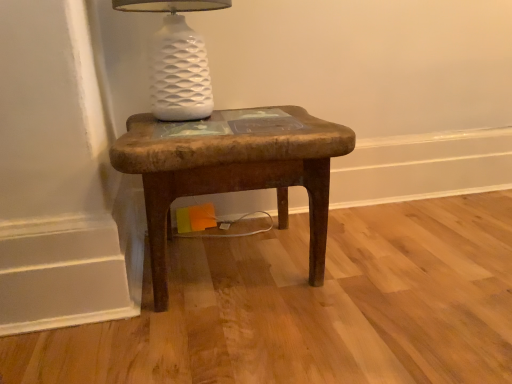
In order to face white ceramic lamp at upper center, should I rotate leftwards or rightwards?

Rotate left and turn 10.323 degrees.

This screenshot has width=512, height=384. Identify the location of white ceramic lamp at upper center. (177, 60).

What do you see at coordinates (177, 60) in the screenshot? I see `white ceramic lamp at upper center` at bounding box center [177, 60].

What do you see at coordinates (231, 169) in the screenshot? I see `rustic wood stool at center` at bounding box center [231, 169].

This screenshot has height=384, width=512. Find the location of `rustic wood stool at center`. rustic wood stool at center is located at coordinates (231, 169).

In order to click on white ceramic lamp at upper center in this screenshot , I will do `click(177, 60)`.

Is rustic wood stool at center to the right of white ceramic lamp at upper center from the viewer's perspective?

Indeed, rustic wood stool at center is positioned on the right side of white ceramic lamp at upper center.

Which object is closer to the camera, rustic wood stool at center or white ceramic lamp at upper center?

rustic wood stool at center is more forward.

Is point (225, 177) behind point (158, 48)?

No.

From the image's perspective, is rustic wood stool at center positioned above or below white ceramic lamp at upper center?

Based on their image positions, rustic wood stool at center is located beneath white ceramic lamp at upper center.

From a real-world perspective, is rustic wood stool at center positioned under white ceramic lamp at upper center based on gravity?

Yes, from a real-world perspective, rustic wood stool at center is beneath white ceramic lamp at upper center.

In the scene shown: Between rustic wood stool at center and white ceramic lamp at upper center, which one has larger width?

rustic wood stool at center.

Which of these two, rustic wood stool at center or white ceramic lamp at upper center, stands shorter?

Standing shorter between the two is white ceramic lamp at upper center.

Based on their sizes in the image, would you say rustic wood stool at center is bigger or smaller than white ceramic lamp at upper center?

In the image, rustic wood stool at center appears to be larger than white ceramic lamp at upper center.

Is rustic wood stool at center spatially inside white ceramic lamp at upper center, or outside of it?

rustic wood stool at center cannot be found inside white ceramic lamp at upper center.

Is rustic wood stool at center directly adjacent to white ceramic lamp at upper center?

No, rustic wood stool at center is not beside white ceramic lamp at upper center.

Does rustic wood stool at center turn towards white ceramic lamp at upper center?

No, rustic wood stool at center does not turn towards white ceramic lamp at upper center.

How different are the orientations of rustic wood stool at center and white ceramic lamp at upper center in degrees?

The facing directions of rustic wood stool at center and white ceramic lamp at upper center are 0.000462 degrees apart.

This screenshot has width=512, height=384. What are the coordinates of `stool located on the right of white ceramic lamp at upper center` in the screenshot? It's located at (231, 169).

Does white ceramic lamp at upper center appear on the left side of rustic wood stool at center?

Yes, white ceramic lamp at upper center is to the left of rustic wood stool at center.

From the picture: Considering the relative positions of white ceramic lamp at upper center and rustic wood stool at center in the image provided, is white ceramic lamp at upper center in front of rustic wood stool at center?

No, white ceramic lamp at upper center is further to the viewer.

Is point (177, 108) positioned after point (143, 181)?

Yes, point (177, 108) is farther from viewer.

From the picture: From the image's perspective, which is below, white ceramic lamp at upper center or rustic wood stool at center?

rustic wood stool at center is shown below in the image.

From a real-world perspective, which object stands above the other?

white ceramic lamp at upper center, from a real-world perspective.

Is white ceramic lamp at upper center wider than rustic wood stool at center?

Incorrect, the width of white ceramic lamp at upper center does not surpass that of rustic wood stool at center.

Considering the relative sizes of white ceramic lamp at upper center and rustic wood stool at center in the image provided, is white ceramic lamp at upper center taller than rustic wood stool at center?

No, white ceramic lamp at upper center is not taller than rustic wood stool at center.

Is white ceramic lamp at upper center bigger than rustic wood stool at center?

No.

Could rustic wood stool at center be considered to be inside white ceramic lamp at upper center?

No, rustic wood stool at center is not surrounded by white ceramic lamp at upper center.

Are white ceramic lamp at upper center and rustic wood stool at center located far from each other?

white ceramic lamp at upper center is actually quite close to rustic wood stool at center.

Is white ceramic lamp at upper center aimed at rustic wood stool at center?

No.

How different are the orientations of white ceramic lamp at upper center and rustic wood stool at center in degrees?

0.000462 degrees separate the facing orientations of white ceramic lamp at upper center and rustic wood stool at center.

How distant is white ceramic lamp at upper center from rustic wood stool at center?

A distance of 7.59 inches exists between white ceramic lamp at upper center and rustic wood stool at center.

What are the coordinates of `table lamp behind the rustic wood stool at center` in the screenshot? It's located at (177, 60).

Find the location of a particular element. stool in front of the white ceramic lamp at upper center is located at coordinates (231, 169).

I want to click on stool below the white ceramic lamp at upper center (from the image's perspective), so click(231, 169).